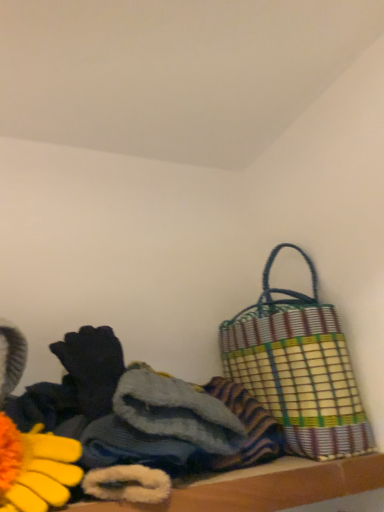
The image size is (384, 512). Identify the location of woven multicolored bag at right. (298, 369).

Describe the element at coordinates (298, 369) in the screenshot. I see `woven multicolored bag at right` at that location.

Image resolution: width=384 pixels, height=512 pixels. Find the location of `woven multicolored bag at right`. woven multicolored bag at right is located at coordinates (298, 369).